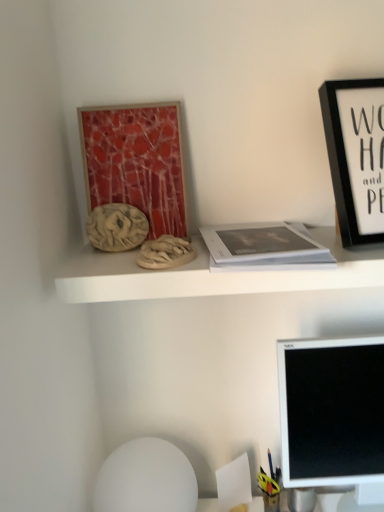
Measure the distance between point (378, 126) and camera.

A distance of 32.80 inches exists between point (378, 126) and camera.

The image size is (384, 512). What do you see at coordinates (331, 411) in the screenshot? I see `white glossy computer monitor at lower right` at bounding box center [331, 411].

Describe the element at coordinates (136, 162) in the screenshot. I see `matte red mosaic art at upper left` at that location.

Locate an element on the screen. matte red mosaic art at upper left is located at coordinates (136, 162).

What is the approximate height of white matte book at center?

white matte book at center is 1.08 inches tall.

What do you see at coordinates (116, 227) in the screenshot? I see `matte clay sculpture at upper left` at bounding box center [116, 227].

Image resolution: width=384 pixels, height=512 pixels. In order to click on black matte picture frame at upper right in this screenshot , I will do `click(356, 156)`.

Consider the image. Measure the distance between black matte picture frame at upper right and matte red mosaic art at upper left.

black matte picture frame at upper right and matte red mosaic art at upper left are 15.15 inches apart from each other.

Which object is wider, black matte picture frame at upper right or matte red mosaic art at upper left?

black matte picture frame at upper right is wider.

What's the angular difference between black matte picture frame at upper right and matte red mosaic art at upper left's facing directions?

There is a 8.35-degree angle between the facing directions of black matte picture frame at upper right and matte red mosaic art at upper left.

Which object is more forward, black matte picture frame at upper right or matte red mosaic art at upper left?

black matte picture frame at upper right is more forward.

Is matte wood shelf at upper center at the right side of white matte book at center?

Incorrect, matte wood shelf at upper center is not on the right side of white matte book at center.

Can white matte book at center be found inside matte wood shelf at upper center?

That's incorrect, white matte book at center is not inside matte wood shelf at upper center.

Find the location of a particular element. The height and width of the screenshot is (512, 384). shelf below the white matte book at center (from a real-world perspective) is located at coordinates (209, 275).

Is matte wood shelf at upper center taller than white matte book at center?

Yes.

From a real-world perspective, relative to matte clay sculpture at upper left, is white glossy computer monitor at lower right vertically above or below?

From a real-world perspective, white glossy computer monitor at lower right is physically below matte clay sculpture at upper left.

Choose the correct answer: Is white glossy computer monitor at lower right inside matte clay sculpture at upper left or outside it?

white glossy computer monitor at lower right is located beyond the bounds of matte clay sculpture at upper left.

From the image's perspective, which is below, white glossy computer monitor at lower right or matte clay sculpture at upper left?

white glossy computer monitor at lower right.

Considering the relative sizes of white glossy computer monitor at lower right and matte clay sculpture at upper left in the image provided, is white glossy computer monitor at lower right shorter than matte clay sculpture at upper left?

No, white glossy computer monitor at lower right is not shorter than matte clay sculpture at upper left.

Relative to black matte picture frame at upper right, is matte red mosaic art at upper left in front or behind?

matte red mosaic art at upper left is behind black matte picture frame at upper right.

Identify the location of bulletin board located behind the black matte picture frame at upper right. This screenshot has width=384, height=512. (136, 162).

Can you confirm if matte red mosaic art at upper left is wider than black matte picture frame at upper right?

No, matte red mosaic art at upper left is not wider than black matte picture frame at upper right.

Is the depth of matte wood shelf at upper center less than that of black matte picture frame at upper right?

No, the depth of matte wood shelf at upper center is greater than that of black matte picture frame at upper right.

From a real-world perspective, who is located lower, matte wood shelf at upper center or black matte picture frame at upper right?

In real-world perspective, matte wood shelf at upper center is lower.

How different are the orientations of matte wood shelf at upper center and black matte picture frame at upper right in degrees?

11 degrees separate the facing orientations of matte wood shelf at upper center and black matte picture frame at upper right.

Can white matte sphere at lower center be found inside white glossy computer monitor at lower right?

Actually, white matte sphere at lower center is outside white glossy computer monitor at lower right.

Which is farther, [357,449] or [94,504]?

The point [94,504] is farther from the camera.

From a real-world perspective, is white glossy computer monitor at lower right physically below white matte sphere at lower center?

No, from a real-world perspective, white glossy computer monitor at lower right is not below white matte sphere at lower center.

Considering the sizes of objects matte red mosaic art at upper left and matte wood shelf at upper center in the image provided, who is shorter, matte red mosaic art at upper left or matte wood shelf at upper center?

With less height is matte wood shelf at upper center.

Which is nearer, (154,160) or (97,267)?

Point (154,160) appears to be farther away from the viewer than point (97,267).

Considering the relative positions of matte red mosaic art at upper left and matte wood shelf at upper center in the image provided, is matte red mosaic art at upper left behind matte wood shelf at upper center?

Yes, matte red mosaic art at upper left is behind matte wood shelf at upper center.

From the image's perspective, is matte red mosaic art at upper left below matte wood shelf at upper center?

Actually, matte red mosaic art at upper left appears above matte wood shelf at upper center in the image.

This screenshot has height=512, width=384. In order to click on picture frame that is above the matte red mosaic art at upper left (from a real-world perspective) in this screenshot , I will do `click(356, 156)`.

At what (x,y) coordinates should I click in order to perform the action: click on paperback book located on the right of matte wood shelf at upper center. Please return your answer as a coordinate pair (x, y). Looking at the image, I should click on (261, 246).

Considering their positions, is white matte sphere at lower center positioned closer to matte wood shelf at upper center than white matte book at center?

white matte book at center is closer to matte wood shelf at upper center.

From the picture: When comparing their distances from white matte sphere at lower center, does white glossy computer monitor at lower right or matte clay sculpture at upper left seem closer?

white glossy computer monitor at lower right is positioned closer to the anchor white matte sphere at lower center.

Estimate the real-world distances between objects in this image. Which object is further from matte wood shelf at upper center, matte clay sculpture at upper left or matte red mosaic art at upper left?

Based on the image, matte red mosaic art at upper left appears to be further to matte wood shelf at upper center.

Based on their spatial positions, is black matte picture frame at upper right or white matte book at center further from matte red mosaic art at upper left?

The object further to matte red mosaic art at upper left is black matte picture frame at upper right.

Based on the photo, considering their positions, is white matte book at center positioned further to white glossy computer monitor at lower right than white matte sphere at lower center?

white matte sphere at lower center is further to white glossy computer monitor at lower right.

From the image, which object appears to be nearer to matte clay sculpture at upper left, black matte picture frame at upper right or white matte book at center?

white matte book at center lies closer to matte clay sculpture at upper left than the other object.

Estimate the real-world distances between objects in this image. Which object is closer to matte red mosaic art at upper left, white matte sphere at lower center or matte clay sculpture at upper left?

matte clay sculpture at upper left is positioned closer to the anchor matte red mosaic art at upper left.

Considering their positions, is white matte sphere at lower center positioned further to black matte picture frame at upper right than matte red mosaic art at upper left?

Among the two, white matte sphere at lower center is located further to black matte picture frame at upper right.

The image size is (384, 512). Identify the location of computer monitor that lies between white matte book at center and white matte sphere at lower center from top to bottom. (331, 411).

Image resolution: width=384 pixels, height=512 pixels. In order to click on computer monitor between matte wood shelf at upper center and white matte sphere at lower center in the up-down direction in this screenshot , I will do `click(331, 411)`.

The height and width of the screenshot is (512, 384). Identify the location of paperback book between matte wood shelf at upper center and black matte picture frame at upper right in the horizontal direction. (261, 246).

Identify the location of paperback book between black matte picture frame at upper right and white glossy computer monitor at lower right in the vertical direction. (261, 246).